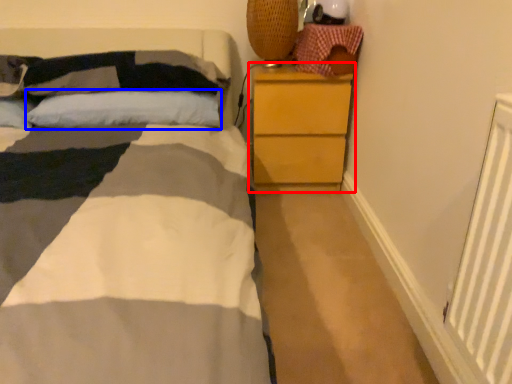
Question: Which of the following is the farthest to the observer, chest of drawers (highlighted by a red box) or pillow (highlighted by a blue box)?

Choices:
 (A) chest of drawers
 (B) pillow

Answer: (A)